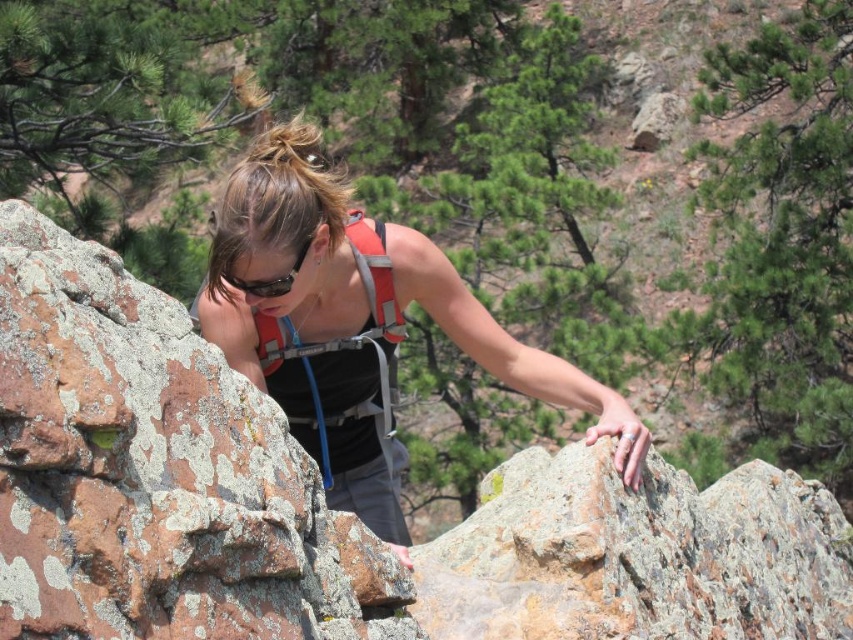
Question: Is lichen-covered rock at center to the right of black matte sunglasses at center from the viewer's perspective?

Choices:
 (A) yes
 (B) no

Answer: (B)

Question: Estimate the real-world distances between objects in this image. Which object is farther from the black matte sunglasses at center?

Choices:
 (A) lichen-covered rock at center
 (B) rusty rock at center
 (C) matte black tank top at center
 (D) orange fabric vest at center

Answer: (B)

Question: Considering the relative positions of lichen-covered rock at center and matte black tank top at center in the image provided, where is lichen-covered rock at center located with respect to matte black tank top at center?

Choices:
 (A) below
 (B) above

Answer: (B)

Question: Which of these objects is positioned farthest from the orange fabric vest at center?

Choices:
 (A) matte black tank top at center
 (B) black matte sunglasses at center

Answer: (B)

Question: Which point is farther to the camera?

Choices:
 (A) rusty rock at center
 (B) orange fabric vest at center
 (C) black matte sunglasses at center

Answer: (B)

Question: Is matte black tank top at center wider than black matte sunglasses at center?

Choices:
 (A) no
 (B) yes

Answer: (B)